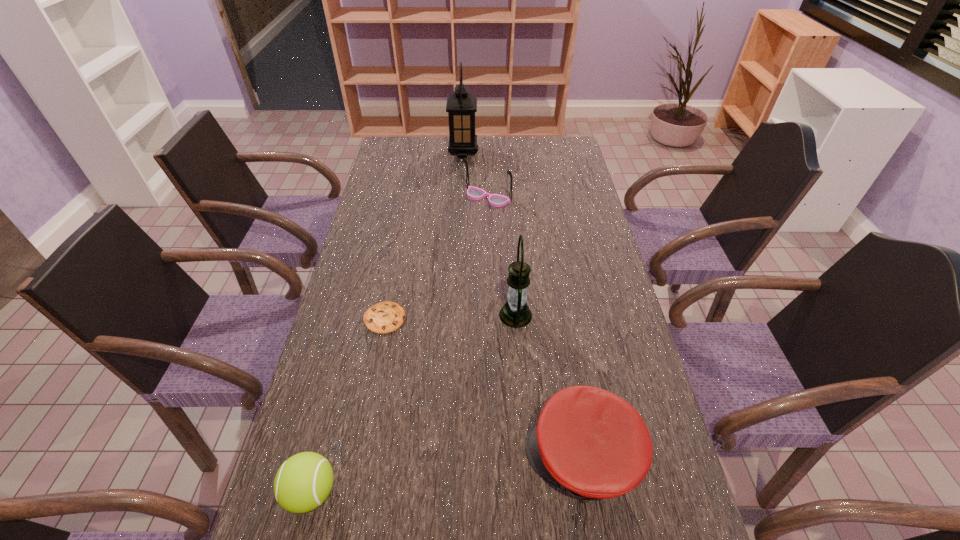
Find the location of a particular element. The height and width of the screenshot is (540, 960). free point that satisfies the following two spatial constraints: 1. on the back side of the cookie; 2. on the right side of the farther lantern is located at coordinates (418, 152).